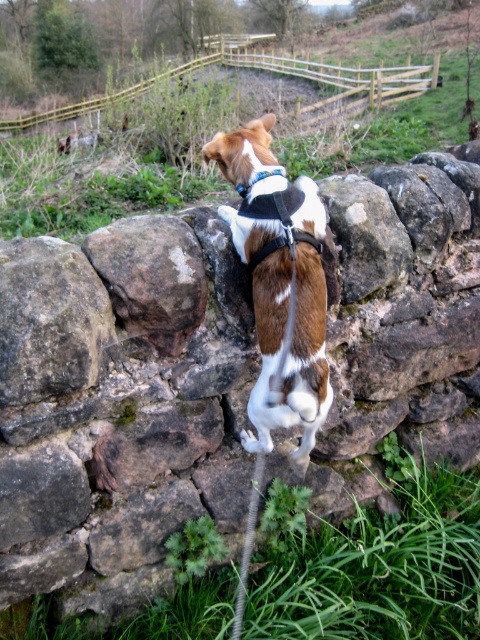
You are a photographer trying to capture the dog in the image. You notice the brown and white fur at upper center and the blue fabric neckband at upper center. Which of these two items has a greater width in the photo?

The brown and white fur at upper center has a greater width than the blue fabric neckband at upper center.

You are a dog owner who wants to ensure your dog stays safe while walking near the brown rough stone at center and the blue fabric neckband at upper center. Considering their sizes, which object might pose a tripping hazard for the dog?

The brown rough stone at center has a larger size compared to the blue fabric neckband at upper center, so the brown rough stone at center is more likely to be a tripping hazard for the dog due to its larger size.

You are a photographer trying to capture a closeup shot of the brown rough stone at center and the blue fabric neckband at upper center. Which object should you focus on first to ensure both are in focus?

The brown rough stone at center is closer to the viewer than the blue fabric neckband at upper center, so you should focus on the brown rough stone at center first to ensure both are in focus.